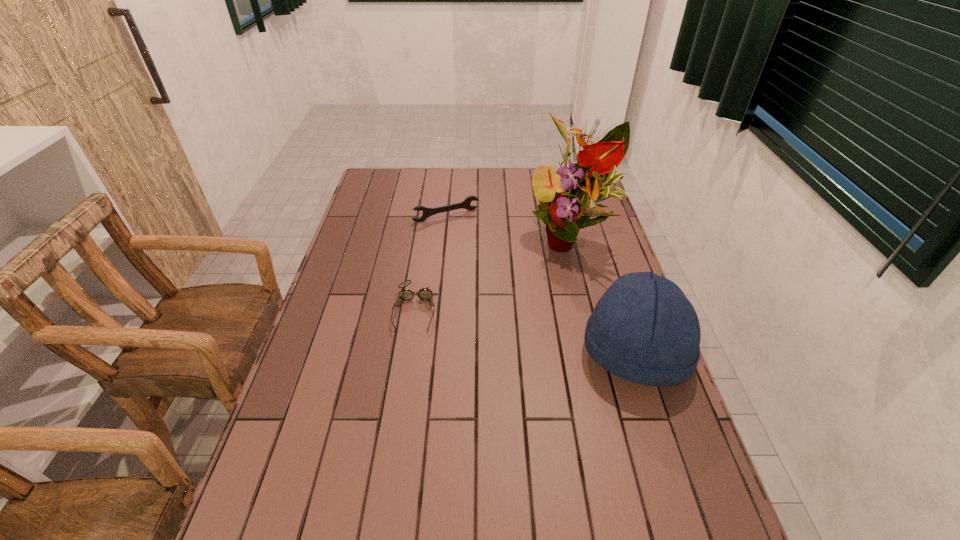
The height and width of the screenshot is (540, 960). I want to click on free area in between the skullcap and the third tallest object, so click(x=540, y=285).

This screenshot has width=960, height=540. Identify the location of free area in between the spectacles and the bouquet. (492, 275).

Locate an element on the screen. This screenshot has width=960, height=540. free space between the shortest object and the tallest object is located at coordinates (492, 275).

At what (x,y) coordinates should I click in order to perform the action: click on free space between the shortest object and the wrench. Please return your answer as a coordinate pair (x, y). The height and width of the screenshot is (540, 960). Looking at the image, I should click on (430, 262).

Locate an element on the screen. This screenshot has height=540, width=960. free space between the shortest object and the third shortest object is located at coordinates (525, 332).

Where is `free space between the tallest object and the spectacles`? free space between the tallest object and the spectacles is located at coordinates (492, 275).

Locate which object is the closest to the wrench. Please provide its 2D coordinates. Your answer should be formatted as a tuple, i.e. [(x, y)], where the tuple contains the x and y coordinates of a point satisfying the conditions above.

[(568, 195)]

Image resolution: width=960 pixels, height=540 pixels. What are the coordinates of `object that is the second nearest to the spectacles` in the screenshot? It's located at (427, 212).

The width and height of the screenshot is (960, 540). What are the coordinates of `vacant area that satisfies the following two spatial constraints: 1. on the front side of the skullcap; 2. on the left side of the tallest object` in the screenshot? It's located at (598, 354).

This screenshot has height=540, width=960. Identify the location of vacant space that satisfies the following two spatial constraints: 1. on the front-facing side of the shortest object; 2. on the right side of the skullcap. (408, 354).